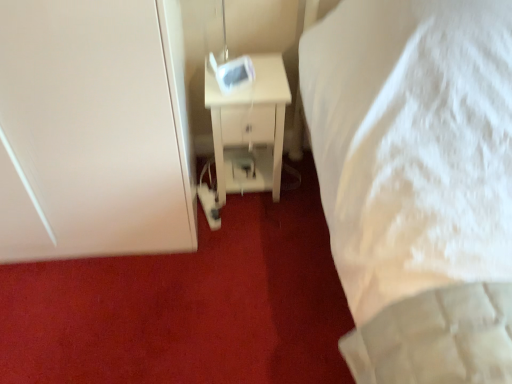
What do you see at coordinates (249, 129) in the screenshot? I see `white glossy nightstand at center` at bounding box center [249, 129].

Find the location of a particular element. The image size is (512, 384). white glossy nightstand at center is located at coordinates (249, 129).

What do you see at coordinates (93, 130) in the screenshot? This screenshot has height=384, width=512. I see `white matte door at left` at bounding box center [93, 130].

The image size is (512, 384). In order to click on white matte door at left in this screenshot , I will do `click(93, 130)`.

What is the approximate height of white matte door at left?

It is 3.39 feet.

Find the location of a particular element. The width and height of the screenshot is (512, 384). white glossy nightstand at center is located at coordinates (249, 129).

Between white matte door at left and white glossy nightstand at center, which one appears on the left side from the viewer's perspective?

white matte door at left.

Consider the image. Considering the relative positions of white matte door at left and white glossy nightstand at center in the image provided, is white matte door at left behind white glossy nightstand at center?

No, it is in front of white glossy nightstand at center.

Considering the positions of points (97, 118) and (207, 79), is point (97, 118) closer to camera compared to point (207, 79)?

Yes, point (97, 118) is closer to viewer.

From the image's perspective, which one is positioned lower, white matte door at left or white glossy nightstand at center?

white glossy nightstand at center, from the image's perspective.

From a real-world perspective, between white matte door at left and white glossy nightstand at center, who is vertically higher?

In real-world perspective, white matte door at left is above.

Can you confirm if white matte door at left is wider than white glossy nightstand at center?

Yes, white matte door at left is wider than white glossy nightstand at center.

Which of these two, white matte door at left or white glossy nightstand at center, stands shorter?

white glossy nightstand at center.

Looking at this image, does white matte door at left have a larger size compared to white glossy nightstand at center?

Correct, white matte door at left is larger in size than white glossy nightstand at center.

Is white matte door at left outside of white glossy nightstand at center?

Yes, white matte door at left is located beyond the bounds of white glossy nightstand at center.

Would you consider white matte door at left to be distant from white glossy nightstand at center?

No, white matte door at left is not far from white glossy nightstand at center.

Could you tell me if white matte door at left is turned towards white glossy nightstand at center?

No, white matte door at left is not facing towards white glossy nightstand at center.

Consider the image. Measure the distance between white matte door at left and white glossy nightstand at center.

white matte door at left is 18.34 inches from white glossy nightstand at center.

At what (x,y) coordinates should I click in order to perform the action: click on door that is above the white glossy nightstand at center (from the image's perspective). Please return your answer as a coordinate pair (x, y). Looking at the image, I should click on (93, 130).

Does white glossy nightstand at center appear on the left side of white matte door at left?

No.

Between white glossy nightstand at center and white matte door at left, which one is positioned behind?

white glossy nightstand at center is behind.

Considering the points (238, 124) and (40, 120), which point is in front, point (238, 124) or point (40, 120)?

The point (40, 120) is in front.

From the image's perspective, relative to white matte door at left, is white glossy nightstand at center above or below?

A: white glossy nightstand at center is below white matte door at left.

From a real-world perspective, who is located higher, white glossy nightstand at center or white matte door at left?

In real-world perspective, white matte door at left is above.

Can you confirm if white glossy nightstand at center is wider than white matte door at left?

In fact, white glossy nightstand at center might be narrower than white matte door at left.

Considering the sizes of objects white glossy nightstand at center and white matte door at left in the image provided, who is taller, white glossy nightstand at center or white matte door at left?

Standing taller between the two is white matte door at left.

In terms of size, does white glossy nightstand at center appear bigger or smaller than white matte door at left?

In the image, white glossy nightstand at center appears to be smaller than white matte door at left.

Would you say white matte door at left is part of white glossy nightstand at center's contents?

No.

Is white glossy nightstand at center beside white matte door at left?

They are not placed beside each other.

Is white glossy nightstand at center turned away from white matte door at left?

No.

This screenshot has height=384, width=512. In order to click on door above the white glossy nightstand at center (from the image's perspective) in this screenshot , I will do 93,130.

You are a GUI agent. You are given a task and a screenshot of the screen. Output one action in this format:
    pyautogui.click(x=<x>, y=<y>)
    Task: Click on the door located in front of the white glossy nightstand at center
    The width and height of the screenshot is (512, 384).
    Given the screenshot: What is the action you would take?
    pyautogui.click(x=93, y=130)

The width and height of the screenshot is (512, 384). In the image, there is a white matte door at left. In order to click on nightstand below it (from the image's perspective) in this screenshot , I will do click(x=249, y=129).